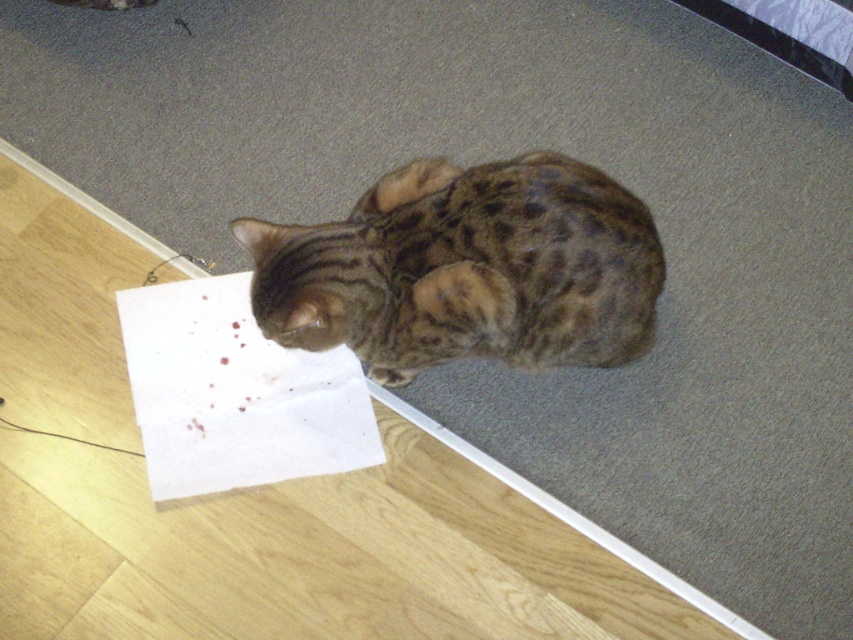
Question: Is spotted fur cat at center to the left of white paper at lower left from the viewer's perspective?

Choices:
 (A) yes
 (B) no

Answer: (B)

Question: Is spotted fur cat at center wider than white paper at lower left?

Choices:
 (A) no
 (B) yes

Answer: (B)

Question: Which object appears farthest from the camera in this image?

Choices:
 (A) white paper at lower left
 (B) spotted fur cat at center

Answer: (A)

Question: Which of the following is the farthest from the observer?

Choices:
 (A) (289, 280)
 (B) (213, 296)

Answer: (B)

Question: Observing the image, what is the correct spatial positioning of spotted fur cat at center in reference to white paper at lower left?

Choices:
 (A) below
 (B) above

Answer: (B)